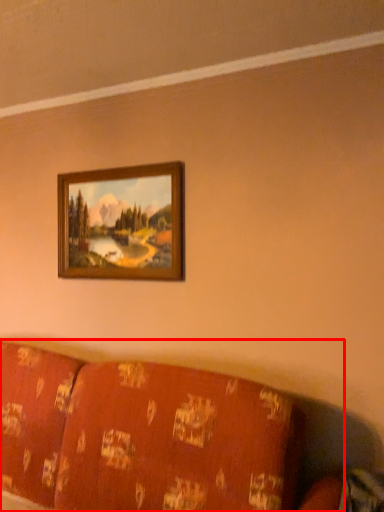
Question: From the image, what is the correct spatial relationship of furniture (annotated by the red box) in relation to picture frame?

Choices:
 (A) right
 (B) left

Answer: (B)